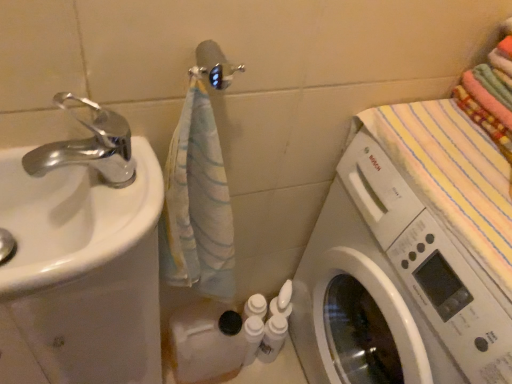
Where is `free point above white plastic washing machine at right (from a real-world perspective)`? free point above white plastic washing machine at right (from a real-world perspective) is located at coordinates (461, 169).